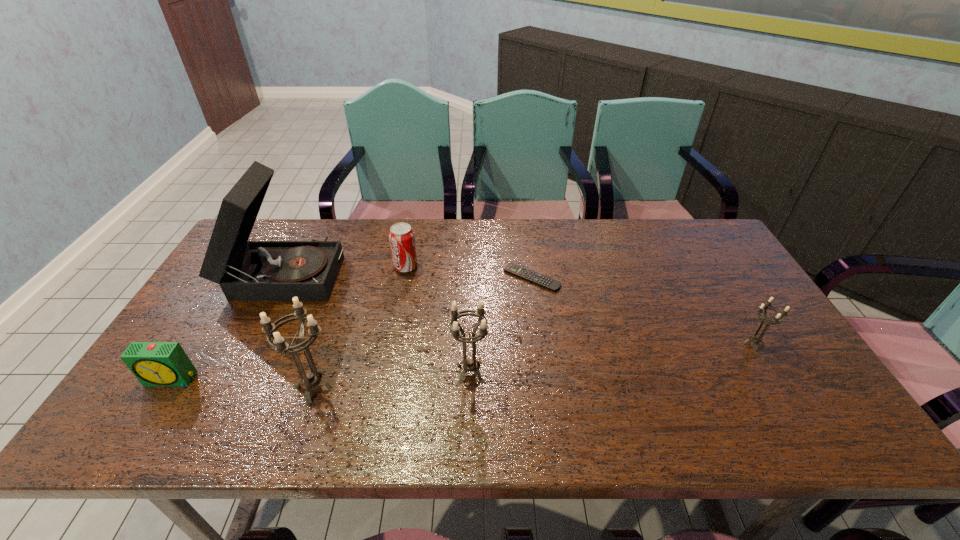
This screenshot has width=960, height=540. Find the location of `vacant region at the near right corner of the desktop`. vacant region at the near right corner of the desktop is located at coordinates (806, 399).

Locate an element on the screen. The width and height of the screenshot is (960, 540). vacant point located between the fourth object from left to right and the phonograph_record is located at coordinates (346, 269).

Locate an element on the screen. The image size is (960, 540). free space between the leftmost candle holder and the rightmost candle holder is located at coordinates (534, 366).

The image size is (960, 540). Find the location of `free point between the fourth nearest object and the leftmost candle holder`. free point between the fourth nearest object and the leftmost candle holder is located at coordinates (534, 366).

This screenshot has width=960, height=540. In order to click on vacant area that lies between the fourth object from left to right and the second candle holder from left to right in this screenshot , I will do `click(438, 320)`.

You are a GUI agent. You are given a task and a screenshot of the screen. Output one action in this format:
    pyautogui.click(x=<x>, y=<y>)
    Task: Click on the free space between the leftmost candle holder and the second candle holder from left to right
    This screenshot has height=540, width=960.
    Given the screenshot: What is the action you would take?
    pyautogui.click(x=393, y=380)

You are a GUI agent. You are given a task and a screenshot of the screen. Output one action in this format:
    pyautogui.click(x=<x>, y=<y>)
    Task: Click on the empty space that is in between the shortest candle holder and the remote control
    The width and height of the screenshot is (960, 540).
    Given the screenshot: What is the action you would take?
    pyautogui.click(x=642, y=311)

The image size is (960, 540). I want to click on vacant space that's between the alarm clock and the second candle holder from right to left, so click(x=321, y=376).

This screenshot has height=540, width=960. Find the location of `vacant region between the tallest object and the soda can`. vacant region between the tallest object and the soda can is located at coordinates (346, 269).

You are a GUI agent. You are given a task and a screenshot of the screen. Output one action in this format:
    pyautogui.click(x=<x>, y=<y>)
    Task: Click on the vacant area that lies between the phonograph_record and the shortest candle holder
    The height and width of the screenshot is (540, 960).
    Given the screenshot: What is the action you would take?
    pyautogui.click(x=519, y=308)